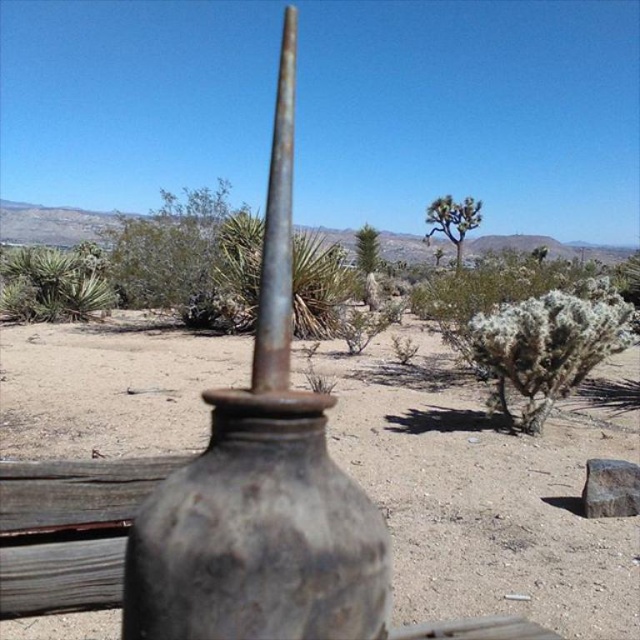
Which of these two, rusty metal vase at center or green shrub at center, stands shorter?

Standing shorter between the two is rusty metal vase at center.

Based on the photo, between rusty metal vase at center and green shrub at center, which one is positioned lower?

Positioned lower is rusty metal vase at center.

Does point (323, 465) come behind point (124, 275)?

No, it is not.

Identify the location of rusty metal vase at center. This screenshot has width=640, height=640. (257, 532).

Can you confirm if rusty metallic dirt field at center is positioned below green shrub at center?

Yes, rusty metallic dirt field at center is below green shrub at center.

Who is lower down, rusty metallic dirt field at center or green shrub at center?

Positioned lower is rusty metallic dirt field at center.

This screenshot has width=640, height=640. I want to click on rusty metallic dirt field at center, so click(x=486, y=506).

At what (x,y) coordinates should I click in order to perform the action: click on rusty metallic dirt field at center. Please return your answer as a coordinate pair (x, y). Looking at the image, I should click on (486, 506).

Can you confirm if rusty metal vase at center is positioned above green leafy tree at center?

No.

Is rusty metal vase at center further to camera compared to green leafy tree at center?

No, rusty metal vase at center is in front of green leafy tree at center.

Is point (140, 568) positioned after point (435, 204)?

No, it is in front of (435, 204).

Where is `rusty metal vase at center`? rusty metal vase at center is located at coordinates (257, 532).